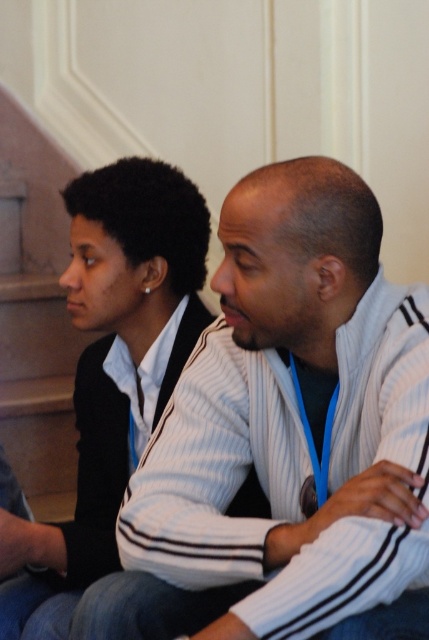
Does white striped sweater at center have a larger size compared to matte white sweater at center?

Indeed, white striped sweater at center has a larger size compared to matte white sweater at center.

Is white striped sweater at center positioned before matte white sweater at center?

Yes, white striped sweater at center is in front of matte white sweater at center.

Measure the distance between white striped sweater at center and camera.

3.78 feet

This screenshot has width=429, height=640. I want to click on white striped sweater at center, so click(287, 436).